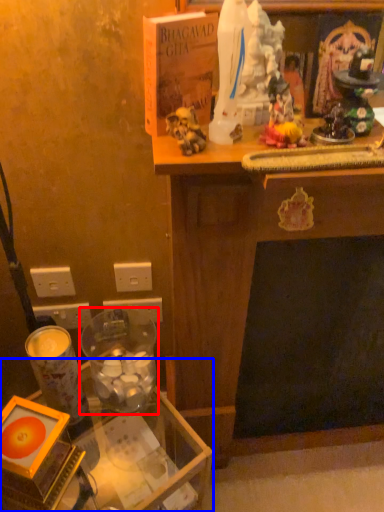
Question: Which object appears farthest to the camera in this image, candle holder (highlighted by a red box) or table (highlighted by a blue box)?

Choices:
 (A) candle holder
 (B) table

Answer: (A)